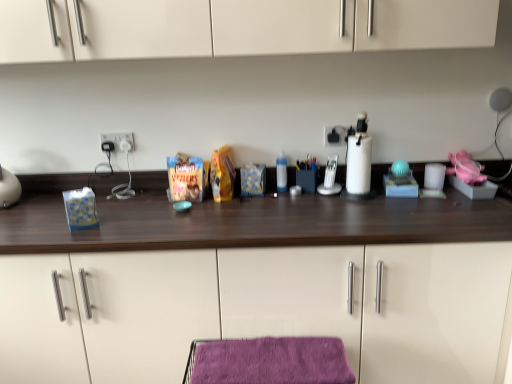
Where is `wooden countertop at center`? Image resolution: width=512 pixels, height=384 pixels. wooden countertop at center is located at coordinates (258, 310).

The width and height of the screenshot is (512, 384). What do you see at coordinates (258, 310) in the screenshot?
I see `wooden countertop at center` at bounding box center [258, 310].

The image size is (512, 384). I want to click on purple velvet towel at lower center, so click(271, 361).

This screenshot has height=384, width=512. I want to click on transparent plastic bottle at center, so click(x=281, y=173).

Find the location of a particular element. This screenshot has width=512, height=384. black plastic electric outlet at upper center, which is the second electric outlet in left-to-right order is located at coordinates (335, 135).

Looking at the image, does transparent plastic bottle at center seem bigger or smaller compared to black plastic electric outlet at upper center, the 1th electric outlet in the right-to-left sequence?

Considering their sizes, transparent plastic bottle at center takes up more space than black plastic electric outlet at upper center, the 1th electric outlet in the right-to-left sequence.

Between transparent plastic bottle at center and black plastic electric outlet at upper center, which is the second electric outlet in left-to-right order, which one has less height?

With less height is black plastic electric outlet at upper center, which is the second electric outlet in left-to-right order.

Can you tell me how much transparent plastic bottle at center and black plastic electric outlet at upper center, the 1th electric outlet in the right-to-left sequence, differ in facing direction?

The angle between the facing direction of transparent plastic bottle at center and the facing direction of black plastic electric outlet at upper center, the 1th electric outlet in the right-to-left sequence, is 5.18 degrees.

From the image's perspective, between transparent plastic bottle at center and black plastic electric outlet at upper center, the 1th electric outlet in the right-to-left sequence, which one is located above?

black plastic electric outlet at upper center, the 1th electric outlet in the right-to-left sequence.

Between wooden countertop at center and purple velvet towel at lower center, which one has larger size?

wooden countertop at center.

Consider the image. From the image's perspective, is wooden countertop at center below purple velvet towel at lower center?

Actually, wooden countertop at center appears above purple velvet towel at lower center in the image.

Is wooden countertop at center facing away from purple velvet towel at lower center?

That's right, wooden countertop at center is facing away from purple velvet towel at lower center.

Is wooden countertop at center with purple velvet towel at lower center?

wooden countertop at center is not next to purple velvet towel at lower center, and they're not touching.

Does black plastic electric outlet at upper center, the 1th electric outlet in the right-to-left sequence, have a greater width compared to transparent plastic bottle at center?

No, black plastic electric outlet at upper center, the 1th electric outlet in the right-to-left sequence, is not wider than transparent plastic bottle at center.

Is black plastic electric outlet at upper center, the 1th electric outlet in the right-to-left sequence, outside of transparent plastic bottle at center?

Yes, black plastic electric outlet at upper center, the 1th electric outlet in the right-to-left sequence, is located beyond the bounds of transparent plastic bottle at center.

From the image's perspective, relative to transparent plastic bottle at center, is black plastic electric outlet at upper center, which is the second electric outlet in left-to-right order, above or below?

black plastic electric outlet at upper center, which is the second electric outlet in left-to-right order, is above transparent plastic bottle at center.

How distant is transparent plastic bottle at center from silver metallic phone at center?

transparent plastic bottle at center is 7.61 inches away from silver metallic phone at center.

Does point (285, 165) appear closer or farther from the camera than point (326, 175)?

Point (285, 165) is farther from the camera than point (326, 175).

From the image's perspective, is transparent plastic bottle at center located beneath silver metallic phone at center?

Incorrect, from the image's perspective, transparent plastic bottle at center is higher than silver metallic phone at center.

From their relative heights in the image, would you say transparent plastic bottle at center is taller or shorter than silver metallic phone at center?

In the image, transparent plastic bottle at center appears to be taller than silver metallic phone at center.

From a real-world perspective, is silver metallic phone at center positioned above or below wooden countertop at center?

From a real-world perspective, silver metallic phone at center is physically above wooden countertop at center.

Is silver metallic phone at center facing towards wooden countertop at center?

Yes, silver metallic phone at center is turned towards wooden countertop at center.

Is point (323, 190) farther from camera compared to point (86, 343)?

That is True.

From the image's perspective, is silver metallic phone at center located beneath wooden countertop at center?

Incorrect, from the image's perspective, silver metallic phone at center is higher than wooden countertop at center.

Based on the photo, is white plastic electric outlet at center, the 2th electric outlet positioned from the right, located within silver metallic phone at center?

No.

There is a silver metallic phone at center. At what (x,y) coordinates should I click in order to perform the action: click on the 1st electric outlet above it (from the image's perspective). Please return your answer as a coordinate pair (x, y). Image resolution: width=512 pixels, height=384 pixels. Looking at the image, I should click on (119, 141).

Which of these two, silver metallic phone at center or white plastic electric outlet at center, the 2th electric outlet positioned from the right, stands taller?

silver metallic phone at center is taller.

Does point (334, 161) come farther from viewer compared to point (123, 146)?

Yes, point (334, 161) is behind point (123, 146).

Is transparent plastic bottle at center to the left or to the right of white plastic electric outlet at center, the 2th electric outlet positioned from the right, in the image?

Based on their positions, transparent plastic bottle at center is located to the right of white plastic electric outlet at center, the 2th electric outlet positioned from the right.

Is transparent plastic bottle at center directly adjacent to white plastic electric outlet at center, the 2th electric outlet positioned from the right?

No, transparent plastic bottle at center is not making contact with white plastic electric outlet at center, the 2th electric outlet positioned from the right.

Is transparent plastic bottle at center bigger than white plastic electric outlet at center, the 1th electric outlet when ordered from left to right?

Indeed, transparent plastic bottle at center has a larger size compared to white plastic electric outlet at center, the 1th electric outlet when ordered from left to right.

How far apart are transparent plastic bottle at center and white plastic electric outlet at center, the 2th electric outlet positioned from the right?

transparent plastic bottle at center is 27.72 inches from white plastic electric outlet at center, the 2th electric outlet positioned from the right.

Identify the location of electric outlet on the right of transparent plastic bottle at center. (335, 135).

Where is `cabinetry that appears below the purple velvet towel at lower center (from a real-world perspective)`? The image size is (512, 384). cabinetry that appears below the purple velvet towel at lower center (from a real-world perspective) is located at coordinates (258, 310).

Looking at the image, which one is located further to purple velvet towel at lower center, silver metallic phone at center or black plastic electric outlet at upper center, which is the second electric outlet in left-to-right order?

The object further to purple velvet towel at lower center is black plastic electric outlet at upper center, which is the second electric outlet in left-to-right order.

Considering their positions, is purple velvet towel at lower center positioned closer to black plastic electric outlet at upper center, the 1th electric outlet in the right-to-left sequence, than transparent plastic bottle at center?

Based on the image, transparent plastic bottle at center appears to be nearer to black plastic electric outlet at upper center, the 1th electric outlet in the right-to-left sequence.

From the image, which object appears to be nearer to white plastic electric outlet at center, the 2th electric outlet positioned from the right, purple velvet towel at lower center or black plastic electric outlet at upper center, the 1th electric outlet in the right-to-left sequence?

The object closer to white plastic electric outlet at center, the 2th electric outlet positioned from the right, is black plastic electric outlet at upper center, the 1th electric outlet in the right-to-left sequence.

Looking at the image, which one is located closer to black plastic electric outlet at upper center, the 1th electric outlet in the right-to-left sequence, purple velvet towel at lower center or silver metallic phone at center?

Based on the image, silver metallic phone at center appears to be nearer to black plastic electric outlet at upper center, the 1th electric outlet in the right-to-left sequence.

Which object lies further to the anchor point transparent plastic bottle at center, white plastic electric outlet at center, the 1th electric outlet when ordered from left to right, or wooden countertop at center?

wooden countertop at center.

Considering their positions, is black plastic electric outlet at upper center, the 1th electric outlet in the right-to-left sequence, positioned closer to purple velvet towel at lower center than white plastic electric outlet at center, the 1th electric outlet when ordered from left to right?

black plastic electric outlet at upper center, the 1th electric outlet in the right-to-left sequence, is closer to purple velvet towel at lower center.

Considering their positions, is wooden countertop at center positioned closer to silver metallic phone at center than white plastic electric outlet at center, the 2th electric outlet positioned from the right?

Among the two, wooden countertop at center is located nearer to silver metallic phone at center.

Considering their positions, is purple velvet towel at lower center positioned closer to white plastic electric outlet at center, the 2th electric outlet positioned from the right, than wooden countertop at center?

The object closer to white plastic electric outlet at center, the 2th electric outlet positioned from the right, is wooden countertop at center.

This screenshot has height=384, width=512. In order to click on bottle between black plastic electric outlet at upper center, the 1th electric outlet in the right-to-left sequence, and wooden countertop at center, in the vertical direction in this screenshot , I will do `click(281, 173)`.

Where is `cabinetry between silver metallic phone at center and purple velvet towel at lower center from top to bottom`? The image size is (512, 384). cabinetry between silver metallic phone at center and purple velvet towel at lower center from top to bottom is located at coordinates [x=258, y=310].

Locate an element on the screen. The height and width of the screenshot is (384, 512). appliance that lies between transparent plastic bottle at center and wooden countertop at center from top to bottom is located at coordinates (330, 178).

Where is `cabinetry located between white plastic electric outlet at center, the 1th electric outlet when ordered from left to right, and silver metallic phone at center in the left-right direction`? Image resolution: width=512 pixels, height=384 pixels. cabinetry located between white plastic electric outlet at center, the 1th electric outlet when ordered from left to right, and silver metallic phone at center in the left-right direction is located at coordinates (258, 310).